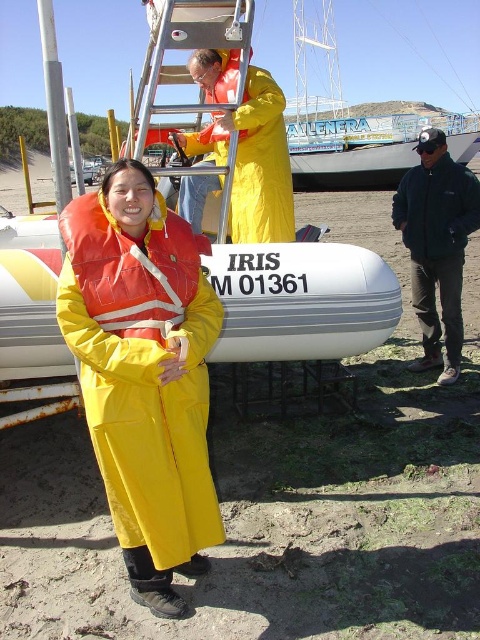
Which is more to the left, yellow matte raincoat at center or metallic silver ladder at upper center?

metallic silver ladder at upper center is more to the left.

Is yellow matte raincoat at center taller than metallic silver ladder at upper center?

No.

This screenshot has height=640, width=480. Identify the location of yellow matte raincoat at center. (252, 161).

Who is shorter, yellow matte life jacket at center or orange/yellow fabric life jacket at center?

With less height is orange/yellow fabric life jacket at center.

Can you confirm if yellow matte life jacket at center is positioned to the left of orange/yellow fabric life jacket at center?

No, yellow matte life jacket at center is not to the left of orange/yellow fabric life jacket at center.

Does point (130, 234) come behind point (93, 225)?

Yes, point (130, 234) is behind point (93, 225).

The image size is (480, 640). In order to click on yellow matte life jacket at center in this screenshot , I will do `click(144, 372)`.

Measure the distance between yellow matte life jacket at center and camera.

They are 2.23 meters apart.

Which is more to the left, yellow matte life jacket at center or yellow matte life jacket at upper center?

yellow matte life jacket at center is more to the left.

The height and width of the screenshot is (640, 480). In order to click on yellow matte life jacket at center in this screenshot , I will do `click(144, 372)`.